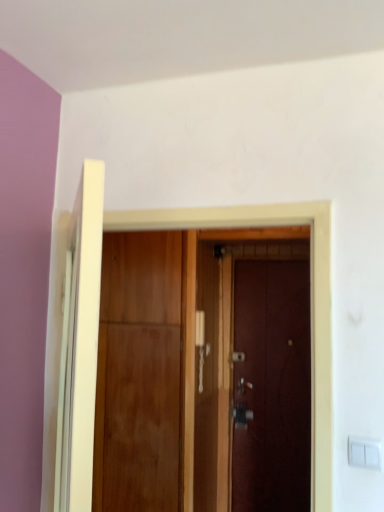
Question: Can you confirm if dark wood door at center, which is the 1th door from back to front, is thinner than wooden door at center, placed as the 1th door when sorted from front to back?

Choices:
 (A) yes
 (B) no

Answer: (A)

Question: Does dark wood door at center, which is the 1th door from back to front, have a greater height compared to wooden door at center, which ranks as the third door in back-to-front order?

Choices:
 (A) yes
 (B) no

Answer: (A)

Question: From the image's perspective, is dark wood door at center, placed as the third door when sorted from front to back, on wooden door at center, placed as the 1th door when sorted from front to back?

Choices:
 (A) yes
 (B) no

Answer: (B)

Question: Does dark wood door at center, placed as the third door when sorted from front to back, have a greater width compared to wooden door at center, which ranks as the third door in back-to-front order?

Choices:
 (A) yes
 (B) no

Answer: (B)

Question: Are dark wood door at center, placed as the third door when sorted from front to back, and wooden door at center, placed as the 1th door when sorted from front to back, far apart?

Choices:
 (A) no
 (B) yes

Answer: (A)

Question: Is dark wood door at center, placed as the third door when sorted from front to back, facing towards wooden door at center, which ranks as the third door in back-to-front order?

Choices:
 (A) no
 (B) yes

Answer: (B)

Question: Does white plastic light switch at lower right appear on the left side of wooden door at center, placed as the 1th door when sorted from front to back?

Choices:
 (A) no
 (B) yes

Answer: (A)

Question: Does white plastic light switch at lower right turn towards wooden door at center, which ranks as the third door in back-to-front order?

Choices:
 (A) no
 (B) yes

Answer: (A)

Question: From a real-world perspective, is white plastic light switch at lower right beneath wooden door at center, placed as the 1th door when sorted from front to back?

Choices:
 (A) yes
 (B) no

Answer: (A)

Question: From a real-world perspective, is white plastic light switch at lower right over wooden door at center, which ranks as the third door in back-to-front order?

Choices:
 (A) no
 (B) yes

Answer: (A)

Question: Is white plastic light switch at lower right to the right of wooden door at center, placed as the 1th door when sorted from front to back, from the viewer's perspective?

Choices:
 (A) yes
 (B) no

Answer: (A)

Question: From the image's perspective, is white plastic light switch at lower right below wooden door at center, placed as the 1th door when sorted from front to back?

Choices:
 (A) no
 (B) yes

Answer: (B)

Question: Is wooden door at center, placed as the 1th door when sorted from front to back, facing towards wooden door at center, the 2th door positioned from the back?

Choices:
 (A) yes
 (B) no

Answer: (B)